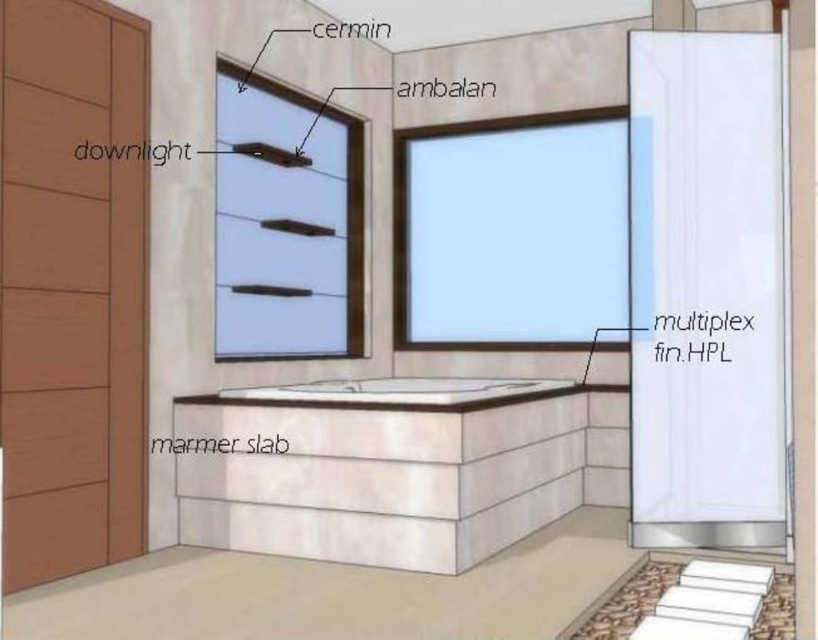
You are standing in the bathroom and want to open the transparent glass window at center to let in some fresh air. However, you notice another transparent glass window at upper center above it. Which window should you open first to avoid blocking the view of the other?

You should open the transparent glass window at upper center first because it is above the transparent glass window at center. Opening the lower window first might cause air turbulence that could make it harder to open the upper one, but since the upper is above, opening it first allows for better airflow without obstruction.

You are designing a bathroom layout and want to ensure proper lighting. You have two transparent glass windows available. The first is the transparent glass window at center, and the second is the transparent glass window at upper center. Which window should you choose if you want the wider one for more natural light?

The transparent glass window at center has a larger width than the transparent glass window at upper center, so you should choose the transparent glass window at center for more natural light.